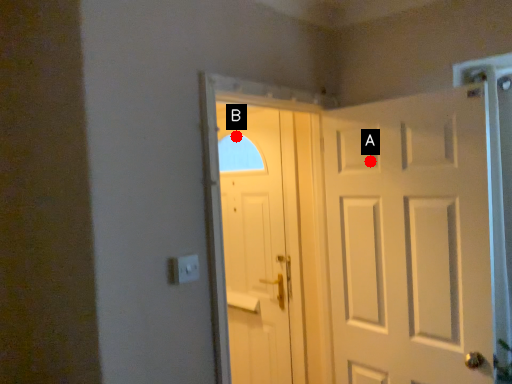
Question: Two points are circled on the image, labeled by A and B beside each circle. Which point is farther to the camera?

Choices:
 (A) A is further
 (B) B is further

Answer: (B)